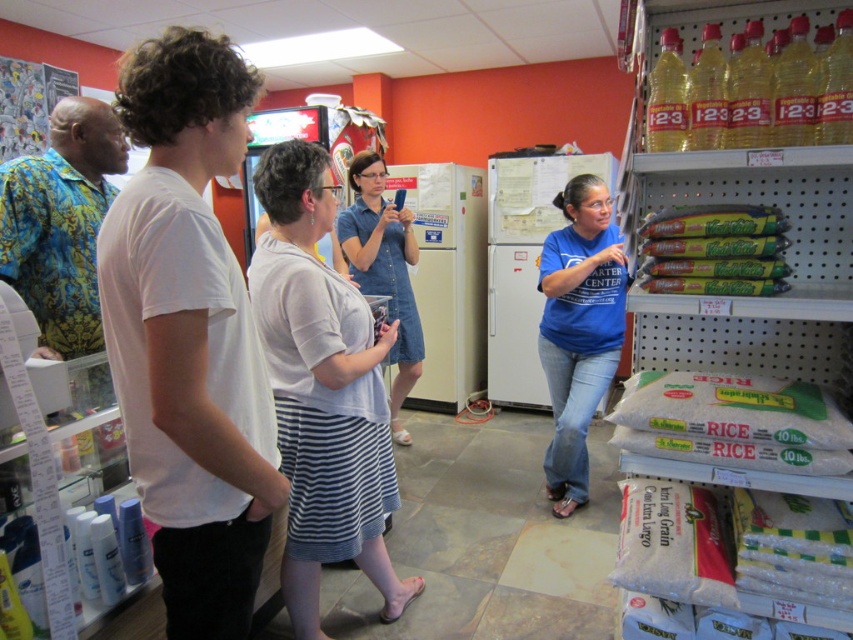
Question: Which object is closer to the camera taking this photo?

Choices:
 (A) green plastic rice bags at right
 (B) blue cotton shirt at center
 (C) denim dress at center
 (D) white cotton t-shirt at center

Answer: (D)

Question: Is green plastic rice bags at right to the right of white cotton shirt at center from the viewer's perspective?

Choices:
 (A) yes
 (B) no

Answer: (A)

Question: Which object is positioned farthest from the white matte rice at lower right?

Choices:
 (A) white cotton shirt at center
 (B) denim dress at center

Answer: (B)

Question: Is white cotton t-shirt at center to the right of green matte fresh pasta at right from the viewer's perspective?

Choices:
 (A) yes
 (B) no

Answer: (B)

Question: Which of the following is the farthest from the observer?

Choices:
 (A) (733, 204)
 (B) (370, 160)
 (C) (576, 332)
 (D) (670, 388)

Answer: (B)

Question: Does white cotton shirt at center appear on the right side of white matte rice at lower right?

Choices:
 (A) no
 (B) yes

Answer: (A)